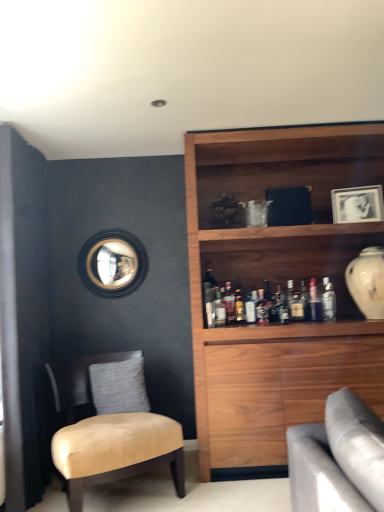
Question: Should I look upward or downward to see matte glass bottle at center, which is counted as the fourth bottle, starting from the right?

Choices:
 (A) up
 (B) down

Answer: (B)

Question: Would you say matte glass bottle at upper right, the fifth bottle positioned from the left, is outside tan leather chair at left?

Choices:
 (A) no
 (B) yes

Answer: (B)

Question: Is matte glass bottle at upper right, the fifth bottle positioned from the left, positioned far away from tan leather chair at left?

Choices:
 (A) yes
 (B) no

Answer: (A)

Question: Does matte glass bottle at upper right, which is the 3th bottle from right to left, have a lesser height compared to tan leather chair at left?

Choices:
 (A) no
 (B) yes

Answer: (B)

Question: Does matte glass bottle at upper right, the fifth bottle positioned from the left, have a smaller size compared to tan leather chair at left?

Choices:
 (A) no
 (B) yes

Answer: (B)

Question: Is matte glass bottle at upper right, the fifth bottle positioned from the left, at the right side of tan leather chair at left?

Choices:
 (A) no
 (B) yes

Answer: (B)

Question: Does matte glass bottle at upper right, which is the 3th bottle from right to left, contain tan leather chair at left?

Choices:
 (A) no
 (B) yes

Answer: (A)

Question: Can you confirm if clear glass bottle at upper right, which is the first bottle from right to left, is taller than matte glass bottle at center, positioned as the second bottle in left-to-right order?

Choices:
 (A) yes
 (B) no

Answer: (A)

Question: Can you confirm if clear glass bottle at upper right, which is the first bottle from right to left, is positioned to the right of matte glass bottle at center, positioned as the second bottle in left-to-right order?

Choices:
 (A) yes
 (B) no

Answer: (A)

Question: Is clear glass bottle at upper right, arranged as the seventh bottle when viewed from the left, beside matte glass bottle at center, positioned as the second bottle in left-to-right order?

Choices:
 (A) yes
 (B) no

Answer: (B)

Question: From a real-world perspective, is clear glass bottle at upper right, arranged as the seventh bottle when viewed from the left, positioned over matte glass bottle at center, placed as the sixth bottle when sorted from right to left, based on gravity?

Choices:
 (A) yes
 (B) no

Answer: (B)

Question: Can matte glass bottle at center, placed as the sixth bottle when sorted from right to left, be found inside clear glass bottle at upper right, arranged as the seventh bottle when viewed from the left?

Choices:
 (A) no
 (B) yes

Answer: (A)

Question: Is clear glass bottle at upper right, arranged as the seventh bottle when viewed from the left, looking in the opposite direction of matte glass bottle at center, positioned as the second bottle in left-to-right order?

Choices:
 (A) no
 (B) yes

Answer: (A)

Question: Is matte glass bottle at upper right, which is the 3th bottle from right to left, wider than satin silver bottle at upper right, the 2th bottle viewed from the right?

Choices:
 (A) no
 (B) yes

Answer: (B)